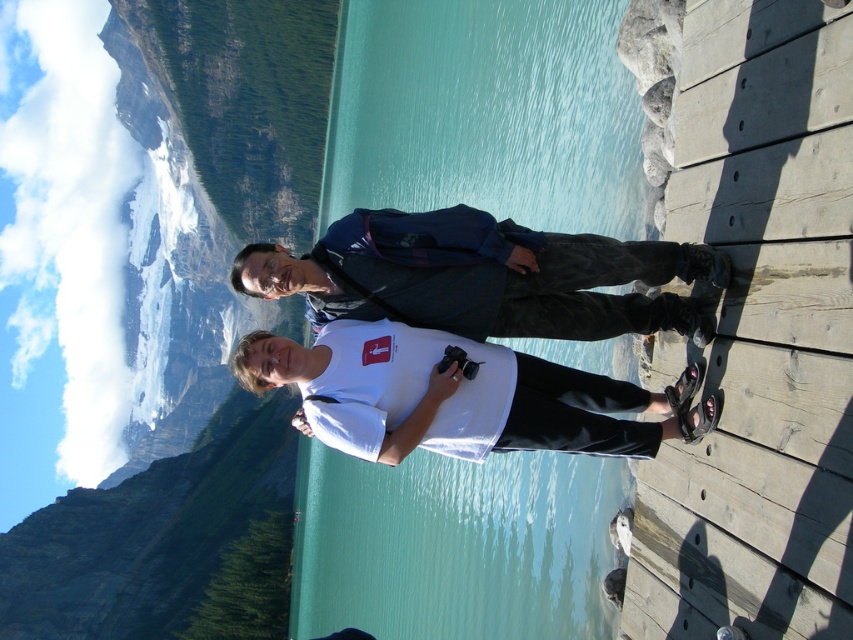
You are a photographer standing on the wooden dock by the turquoise lake. You want to capture a photo of both the dark blue jacket at center and the white matte shirt at center in the same frame. Given that your camera has a maximum focus range of 2.5 meters, will you be able to include both subjects in sharp focus?

The distance between the dark blue jacket at center and the white matte shirt at center is 2.63 meters. Since the camera can only focus up to 2.5 meters, the subjects are slightly out of the camera range. To capture both in sharp focus, you might need to adjust your position or use a different camera setting with a wider focus range.

You are a photographer trying to capture a photo of the two people on the dock. The dark blue jacket at center and the white matte shirt at center are in your viewfinder. Which clothing item should you focus on first if you want to ensure both are in focus?

The dark blue jacket at center is located above the white matte shirt at center, so focusing on the white matte shirt at center first would ensure both are in focus since it is closer to the camera.

You are a photographer trying to capture the reflection of the mountain range in the turquoise water at center. Based on the scene description, where should you position your camera to ensure the reflection is clearly visible in the photo?

The turquoise water at center is located at point (485, 113), so you should position your camera directly above or facing that coordinate to capture the reflection of the mountain range in the water.